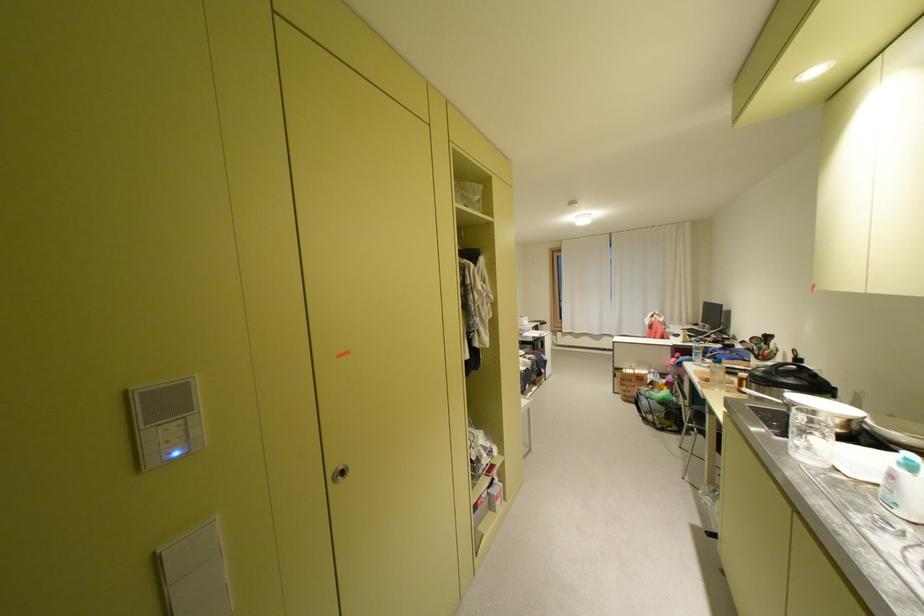
Describe the element at coordinates (784, 371) in the screenshot. I see `the black lid handle` at that location.